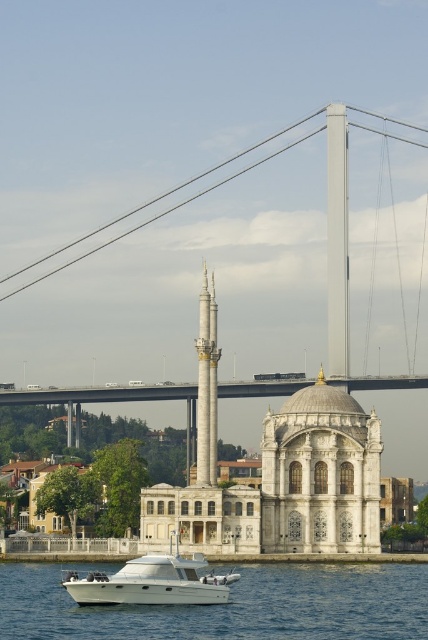
You are a photographer standing on the dock and want to capture both the white glossy boat at lower center and the white glossy water at lower center in a single shot. Which object should you position closer to the left side of the frame to ensure both are visible?

You should position the white glossy boat at lower center closer to the left side of the frame since the white glossy water at lower center is to the right of it, ensuring both are visible in the shot.

You are a passenger on the white glossy boat at lower center. You look up and see the metallic gray suspension bridge at upper center. Can you safely pass under the bridge without hitting it?

The metallic gray suspension bridge at upper center is positioned over the white glossy boat at lower center, so yes, the boat can safely pass under the bridge since the bridge is above it.

You are a photographer planning to capture the metallic gray suspension bridge at upper center and the white glossy boat at lower center in a single frame. Considering their heights, which object should you position closer to the top of the photo to maintain their relative sizes?

The metallic gray suspension bridge at upper center should be positioned closer to the top of the photo since it has a greater height compared to the white glossy boat at lower center, ensuring their relative sizes are accurately represented.